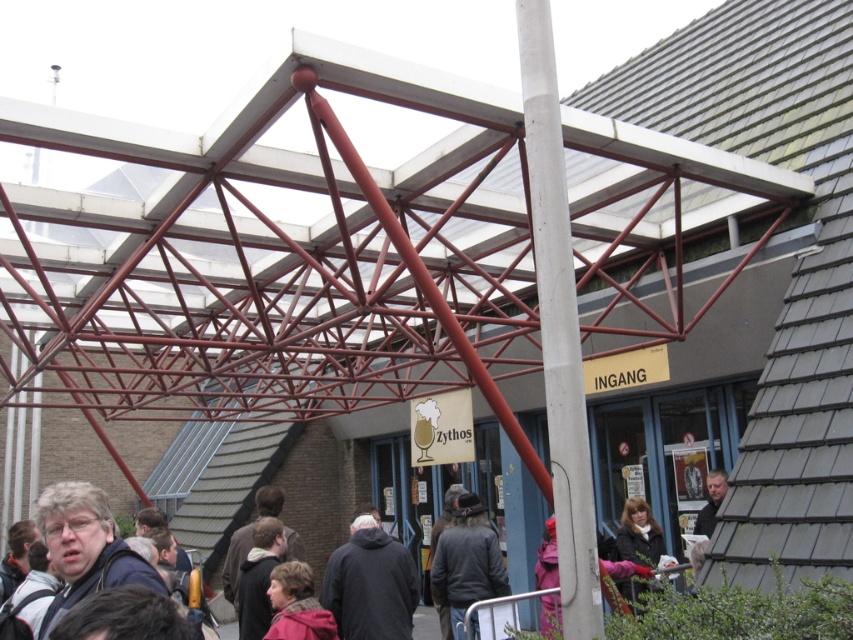
You are trying to decide which coat to take with you. The dark gray hoodie at center and the dark brown leather jacket at center are both hanging on a rack in the entrance area. If you want to choose the wider garment to cover yourself better from the rain, which one should you pick?

The dark gray hoodie at center is wider than the dark brown leather jacket at center, so you should pick the dark gray hoodie at center to cover yourself better from the rain.

You are a photographer setting up a shoot at the entrance of this venue. You need to position two models wearing the dark gray hoodie at center and the dark brown leather jacket at center so that they are both visible in the frame. Based on their current positions, which model should stand where to ensure both are fully visible without overlapping?

The dark gray hoodie at center should be placed to the left and the dark brown leather jacket at center to the right since the dark gray hoodie at center is already positioned on the left side of the dark brown leather jacket at center, maintaining their original spatial relationship ensures both are visible without overlapping.